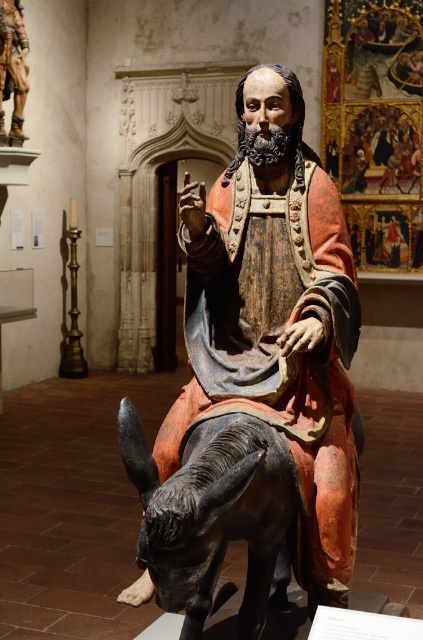
Question: Can you confirm if polychrome wood statue at center is bigger than shiny black donkey at lower left?

Choices:
 (A) no
 (B) yes

Answer: (B)

Question: Can you confirm if shiny black donkey at lower left is smaller than wooden figure at upper left?

Choices:
 (A) no
 (B) yes

Answer: (A)

Question: Which object is closer to the camera taking this photo?

Choices:
 (A) polychrome wood statue at center
 (B) wooden figure at upper left
 (C) shiny black donkey at lower left

Answer: (C)

Question: Which of the following is the closest to the observer?

Choices:
 (A) polychrome wood statue at center
 (B) shiny black donkey at lower left

Answer: (B)

Question: Is polychrome wood statue at center positioned in front of shiny black donkey at lower left?

Choices:
 (A) no
 (B) yes

Answer: (A)

Question: Which point is farther to the camera?

Choices:
 (A) wooden figure at upper left
 (B) polychrome wood statue at center

Answer: (A)